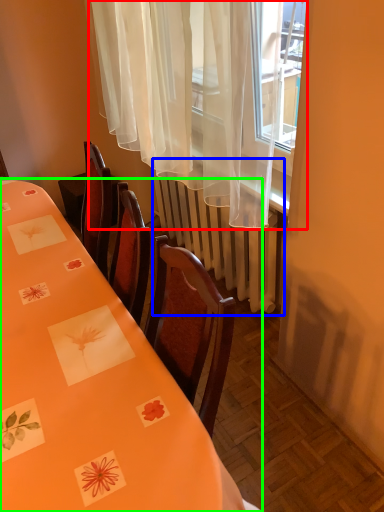
Question: Estimate the real-world distances between objects in this image. Which object is closer to curtain (highlighted by a red box), radiator (highlighted by a blue box) or table (highlighted by a green box)?

Choices:
 (A) radiator
 (B) table

Answer: (A)